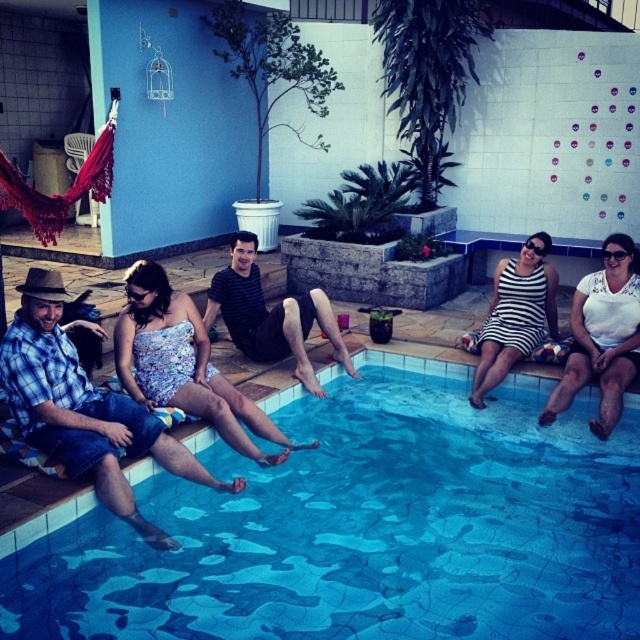
Which is more to the left, blue mosaic tiles at center or floral fabric dress at center?

floral fabric dress at center is more to the left.

Is blue mosaic tiles at center positioned before floral fabric dress at center?

Yes, blue mosaic tiles at center is closer to the viewer.

Find the location of a particular element. blue mosaic tiles at center is located at coordinates (365, 529).

Is point (19, 337) positioned in front of point (550, 301)?

Yes, point (19, 337) is in front of point (550, 301).

This screenshot has height=640, width=640. What do you see at coordinates (83, 408) in the screenshot?
I see `blue plaid shirt at left` at bounding box center [83, 408].

The image size is (640, 640). In order to click on blue plaid shirt at left in this screenshot , I will do `click(83, 408)`.

Find the location of a particular element. blue plaid shirt at left is located at coordinates coord(83,408).

Is point (1, 362) less distant than point (230, 248)?

Yes, it is.

Identify the location of blue plaid shirt at left. tap(83, 408).